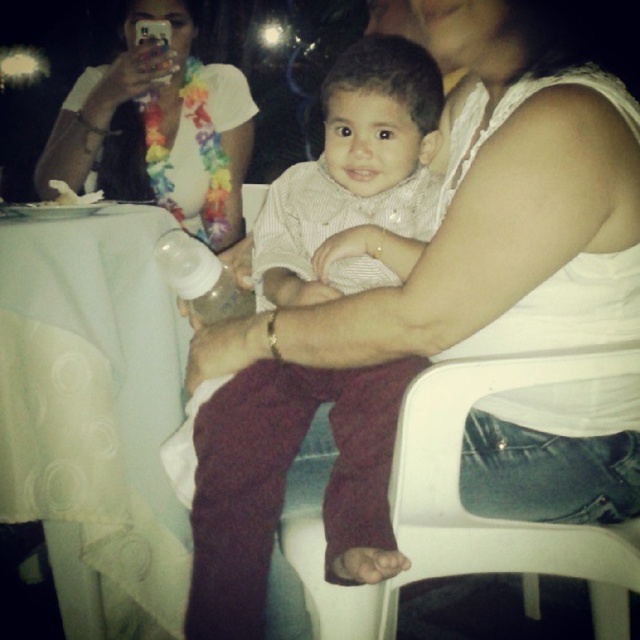
How much distance is there between white fabric table at left and striped cotton shirt at center?

They are 13.01 inches apart.

Describe the element at coordinates (93, 410) in the screenshot. I see `white fabric table at left` at that location.

Locate an element on the screen. Image resolution: width=640 pixels, height=640 pixels. white fabric table at left is located at coordinates (93, 410).

Between white plastic chair at lower right and transparent plastic bottle at center, which one is positioned higher?

transparent plastic bottle at center is higher up.

At what (x,y) coordinates should I click in order to perform the action: click on white plastic chair at lower right. Please return your answer as a coordinate pair (x, y). The height and width of the screenshot is (640, 640). Looking at the image, I should click on (468, 513).

Between point (566, 563) and point (208, 269), which one is positioned in front?

Positioned in front is point (566, 563).

Locate an element on the screen. white plastic chair at lower right is located at coordinates (468, 513).

Does point (250, 500) come in front of point (500, 545)?

No, it is behind (500, 545).

What do you see at coordinates (284, 483) in the screenshot? The image size is (640, 640). I see `striped cotton shirt at center` at bounding box center [284, 483].

I want to click on striped cotton shirt at center, so click(284, 483).